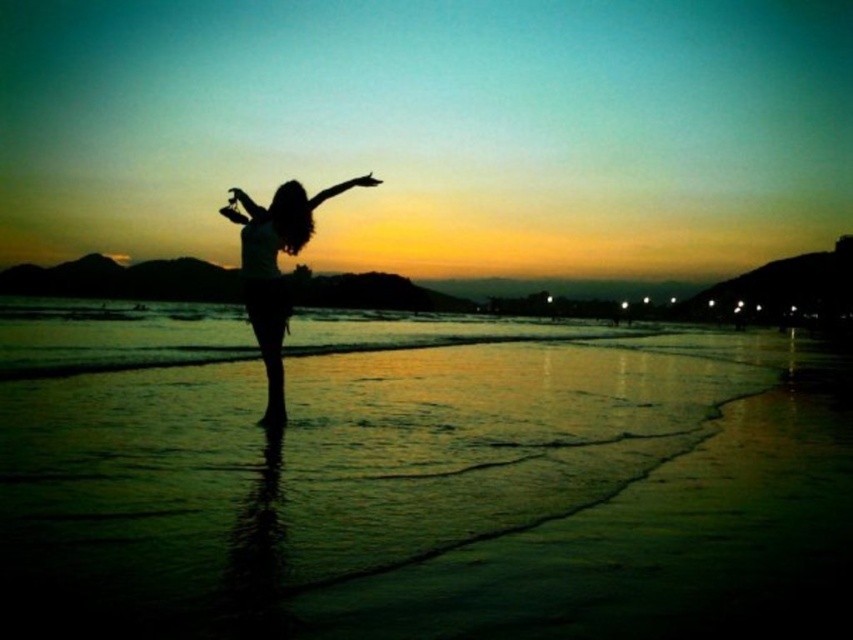
Question: Which point is closer to the camera taking this photo?

Choices:
 (A) (418, 460)
 (B) (271, 317)

Answer: (A)

Question: Does green sand at center have a lesser width compared to silhouette figure at center?

Choices:
 (A) no
 (B) yes

Answer: (A)

Question: From the image, what is the correct spatial relationship of green sand at center in relation to silhouette figure at center?

Choices:
 (A) above
 (B) below

Answer: (B)

Question: Which of the following is the farthest from the observer?

Choices:
 (A) (194, 484)
 (B) (293, 248)

Answer: (B)

Question: Which object is farther from the camera taking this photo?

Choices:
 (A) green sand at center
 (B) silhouette figure at center

Answer: (B)

Question: Does green sand at center have a lesser width compared to silhouette figure at center?

Choices:
 (A) yes
 (B) no

Answer: (B)